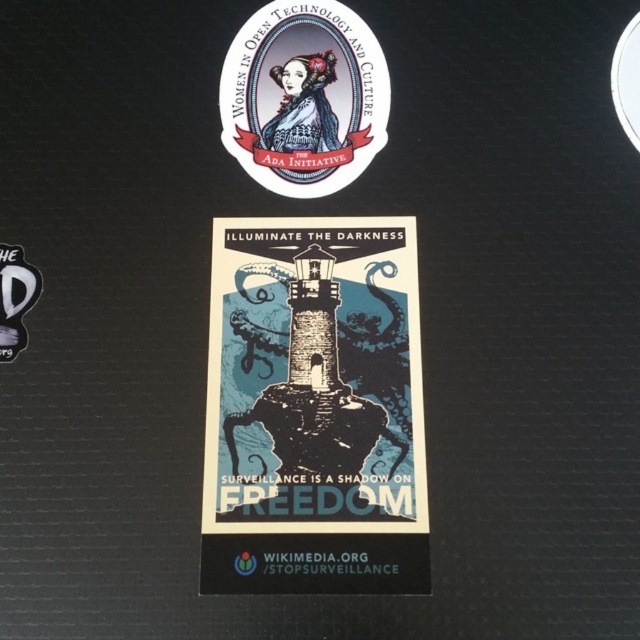
Is blue paper poster at center wider than white fabric logo at lower left?

Indeed, blue paper poster at center has a greater width compared to white fabric logo at lower left.

Between blue paper poster at center and white fabric logo at lower left, which one is positioned lower?

blue paper poster at center is lower down.

The image size is (640, 640). I want to click on blue paper poster at center, so click(314, 410).

Can you confirm if matte paper sticker at upper center is smaller than white fabric logo at lower left?

No, matte paper sticker at upper center is not smaller than white fabric logo at lower left.

Is matte paper sticker at upper center above white fabric logo at lower left?

Yes, matte paper sticker at upper center is above white fabric logo at lower left.

Image resolution: width=640 pixels, height=640 pixels. I want to click on matte paper sticker at upper center, so click(x=304, y=97).

Does blue paper poster at center lie in front of matte paper sticker at upper center?

Yes, blue paper poster at center is in front of matte paper sticker at upper center.

Which is more to the right, blue paper poster at center or matte paper sticker at upper center?

From the viewer's perspective, blue paper poster at center appears more on the right side.

Who is more distant from viewer, [230,330] or [273,44]?

Positioned behind is point [273,44].

Locate an element on the screen. blue paper poster at center is located at coordinates (314, 410).